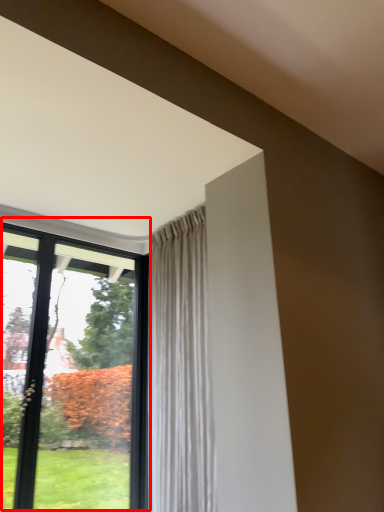
Question: From the image's perspective, where is window (annotated by the red box) located relative to curtain?

Choices:
 (A) below
 (B) above

Answer: (A)